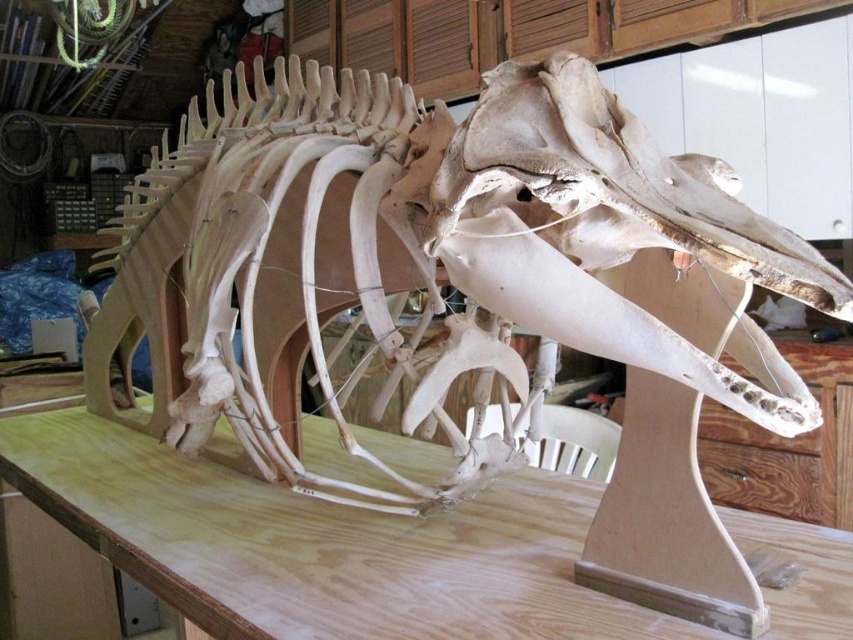
Who is more forward, (177, 497) or (596, 81)?

Positioned in front is point (596, 81).

Does plywood table at center appear under white bone skull at center?

Correct, plywood table at center is located below white bone skull at center.

Describe the element at coordinates (322, 545) in the screenshot. This screenshot has height=640, width=853. I see `plywood table at center` at that location.

The image size is (853, 640). Identify the location of plywood table at center. pyautogui.click(x=322, y=545).

Between point (323, 228) and point (780, 611), which one is positioned behind?

Point (323, 228)

Between point (283, 115) and point (234, 608), which one is positioned in front?

Point (234, 608) is more forward.

Is point (393, 131) closer to camera compared to point (390, 560)?

No, it is not.

This screenshot has height=640, width=853. What are the coordinates of `bone-like skeleton at center` in the screenshot? It's located at (428, 257).

Who is more distant from viewer, (294, 289) or (546, 177)?

Positioned behind is point (294, 289).

In order to click on bone-like skeleton at center in this screenshot , I will do `click(428, 257)`.